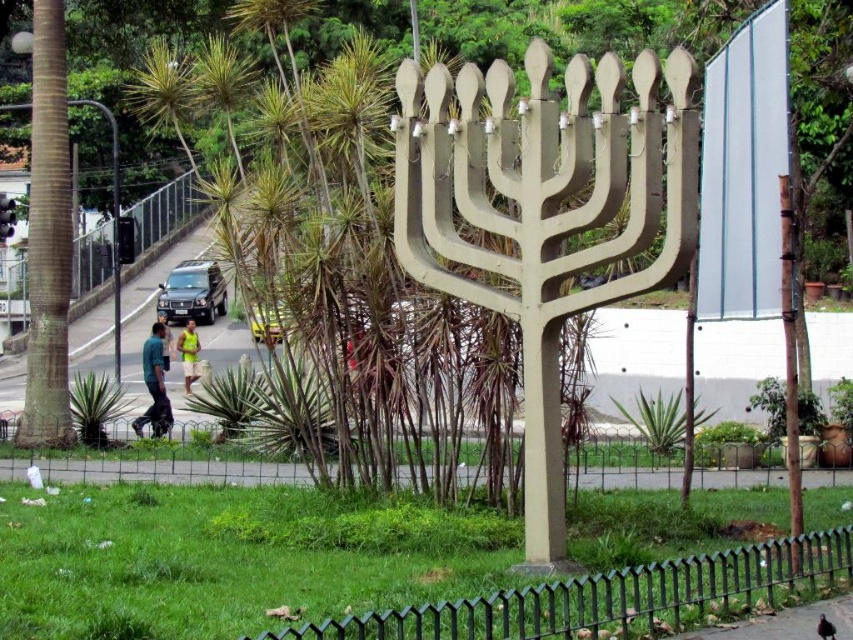
Question: Which object is farther from the camera taking this photo?

Choices:
 (A) green fabric shorts at center
 (B) black wire fence at lower center
 (C) green matte shirt at left

Answer: (A)

Question: Is green metal fence at lower center behind black wire fence at lower center?

Choices:
 (A) yes
 (B) no

Answer: (B)

Question: Which object appears closest to the camera in this image?

Choices:
 (A) green matte shirt at left
 (B) green fabric shorts at center

Answer: (A)

Question: In this image, where is green metal fence at lower center located relative to green matte shirt at left?

Choices:
 (A) above
 (B) below

Answer: (B)

Question: Is the position of green metal fence at lower center more distant than that of green matte shirt at left?

Choices:
 (A) yes
 (B) no

Answer: (B)

Question: Which point is farther to the camera?

Choices:
 (A) black wire fence at lower center
 (B) green fabric shorts at center
 (C) green metal fence at lower center

Answer: (B)